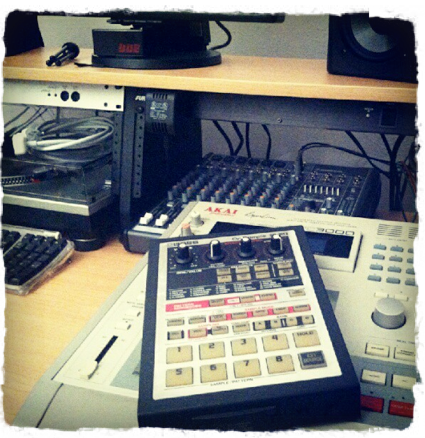
The width and height of the screenshot is (425, 438). What are the coordinates of `black knob` in the screenshot? It's located at (182, 255), (218, 251), (245, 248), (276, 244).